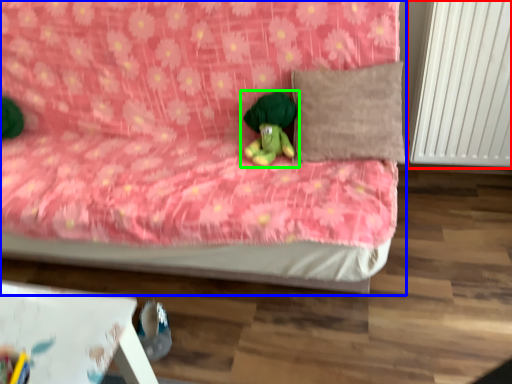
Question: Which object is positioned farthest from radiator (highlighted by a red box)? Select from bed (highlighted by a blue box) and toy (highlighted by a green box).

Choices:
 (A) bed
 (B) toy

Answer: (A)